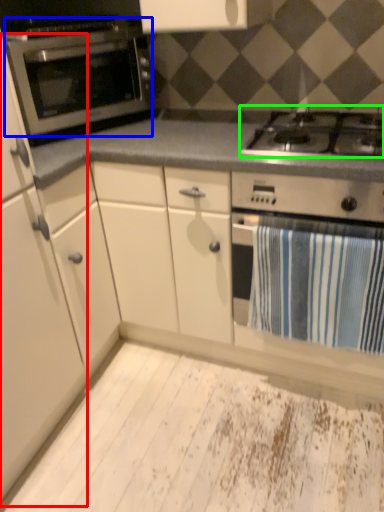
Question: Based on their relative distances, which object is farther from cabinetry (highlighted by a red box)? Choose from oven (highlighted by a blue box) and gas stove (highlighted by a green box).

Choices:
 (A) oven
 (B) gas stove

Answer: (B)